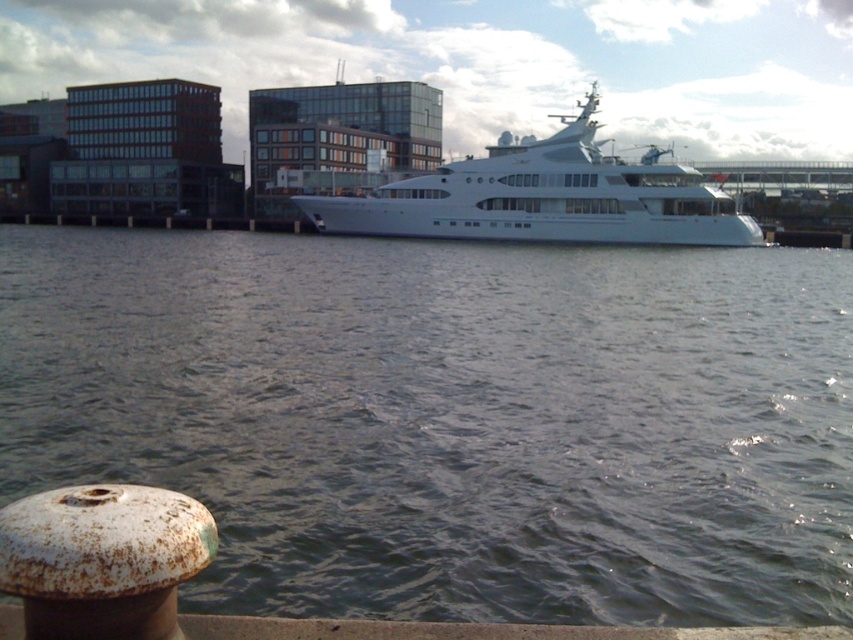
You are a sailor on the white glossy cruise ship at center. You want to check the water quality below your ship. Which direction should you look to see the clear water at center?

The clear water at center is positioned under the white glossy cruise ship at center, so you should look downward to see the clear water at center.

You are standing on the dock near the yacht and want to walk towards the point that is closer to you. Which point should you head towards, point (189, 308) or point (657, 182)?

Point (189, 308) is in front of point (657, 182), so you should head towards point (189, 308) as it is closer to you.

You are a photographer on the dock and want to capture the white glossy cruise ship at center and the clear water at center in your shot. Which object is located to the left of the other?

The clear water at center is positioned on the left side of white glossy cruise ship at center.